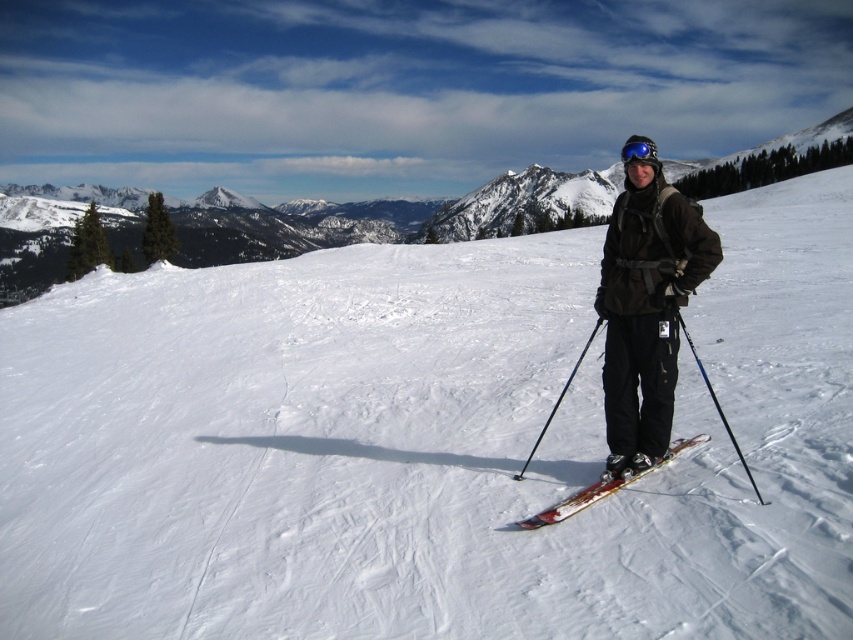
This screenshot has width=853, height=640. Identify the location of matte black ski suit at center. (646, 308).

Is white powder snow at center taller than blue metallic ski pole at center?

Indeed, white powder snow at center has a greater height compared to blue metallic ski pole at center.

Does white powder snow at center appear on the right side of blue metallic ski pole at center?

Correct, you'll find white powder snow at center to the right of blue metallic ski pole at center.

This screenshot has width=853, height=640. What do you see at coordinates (427, 444) in the screenshot?
I see `white powder snow at center` at bounding box center [427, 444].

Where is `white powder snow at center`? This screenshot has width=853, height=640. white powder snow at center is located at coordinates (427, 444).

Does white powder snow at center appear under blue reflective goggles at center?

Yes.

Is white powder snow at center closer to camera compared to blue reflective goggles at center?

Yes, it is in front of blue reflective goggles at center.

Who is more distant from viewer, (136, 628) or (637, 140)?

Point (637, 140)

Find the location of a particular element. This screenshot has height=640, width=853. white powder snow at center is located at coordinates (427, 444).